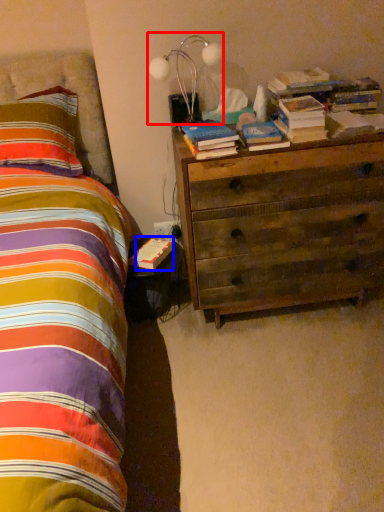
Question: Among these objects, which one is farthest to the camera, lamp (highlighted by a red box) or paperback book (highlighted by a blue box)?

Choices:
 (A) lamp
 (B) paperback book

Answer: (B)